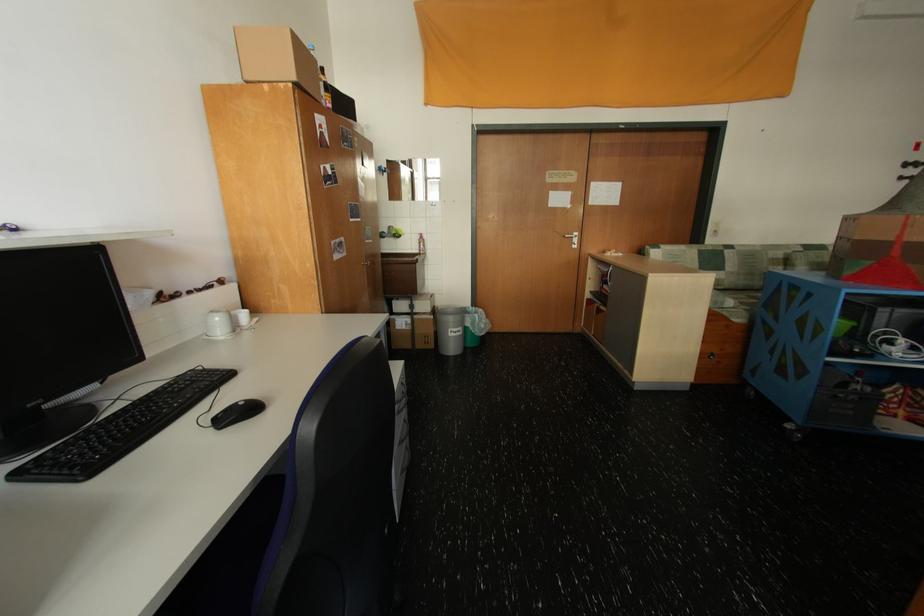
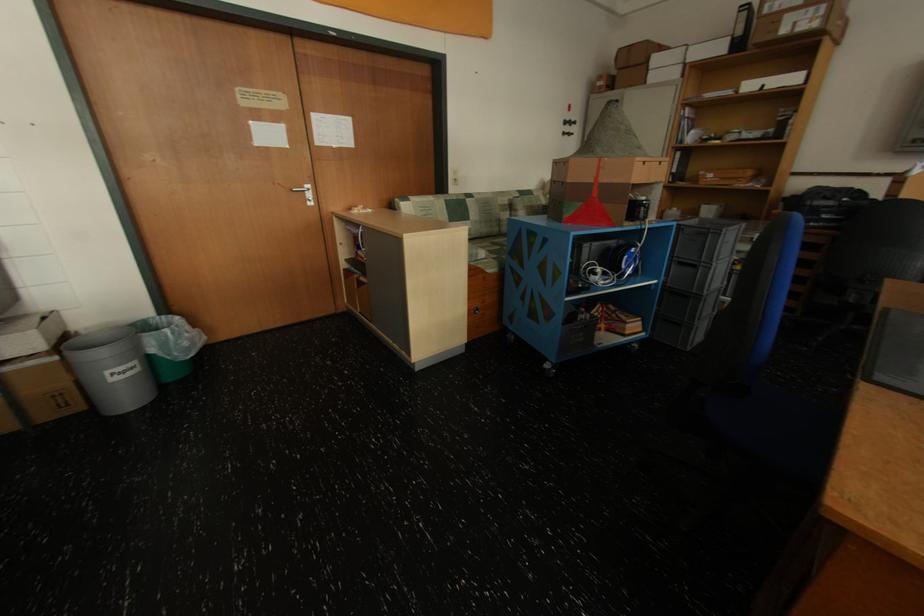
Question: Based on the continuous images, in which direction is the camera rotating? Reply with the corresponding letter.

Choices:
 (A) Left
 (B) Right
 (C) Up
 (D) Down

Answer: (B)